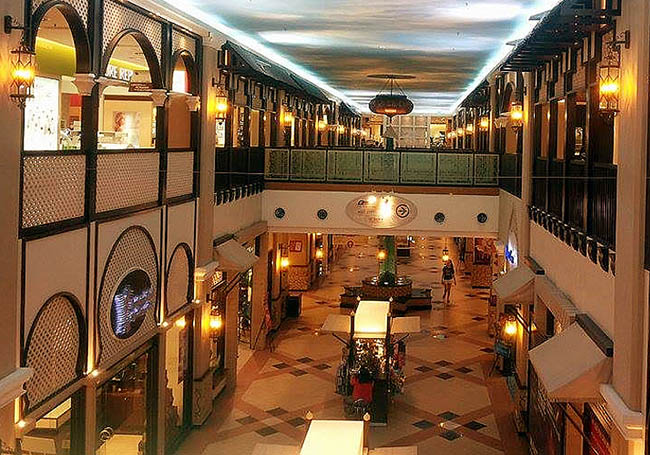
Where is `ceiling`? The image size is (650, 455). ceiling is located at coordinates (410, 54).